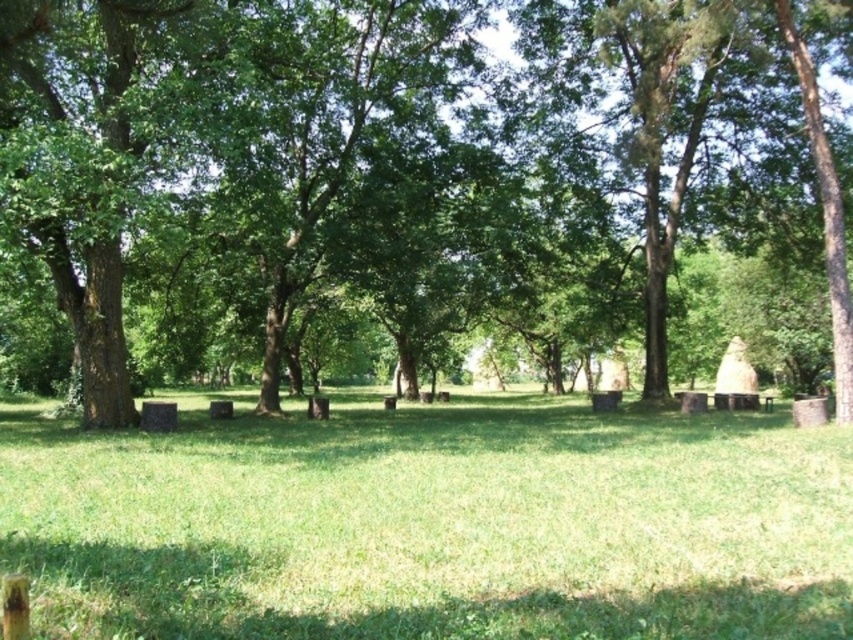
Which is below, brown rough tree at center or green grassy field at center?

green grassy field at center

Is brown rough tree at center further to the viewer compared to green grassy field at center?

Yes, it is.

Find the location of a particular element. brown rough tree at center is located at coordinates [415, 160].

The height and width of the screenshot is (640, 853). Find the location of `brown rough tree at center`. brown rough tree at center is located at coordinates (415, 160).